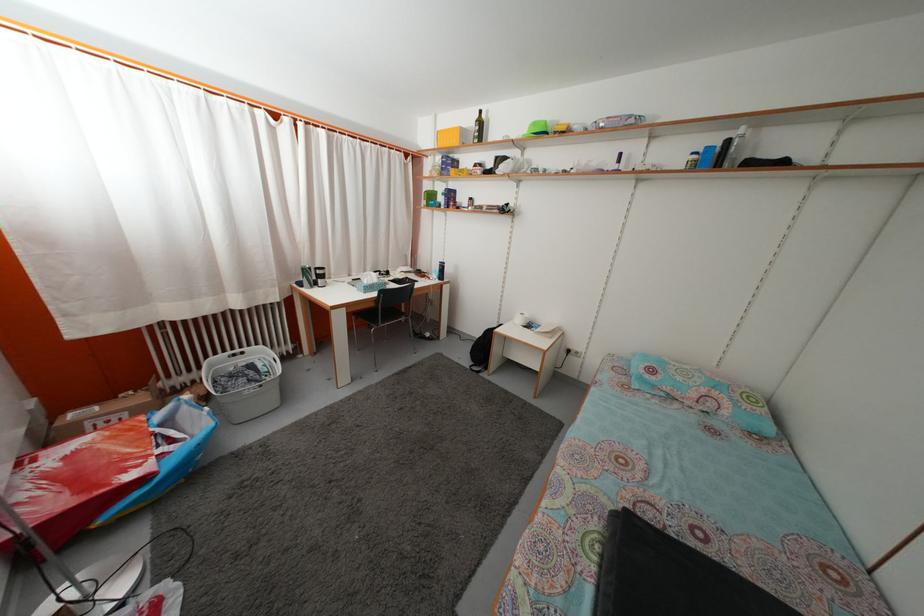
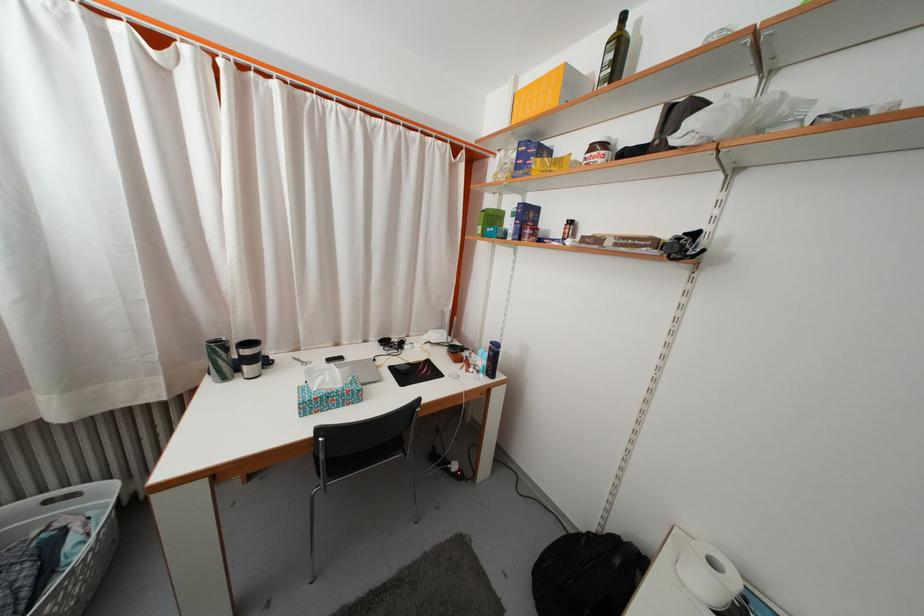
Find the pixel in the second image that matches [485,131] in the first image.

(625, 54)